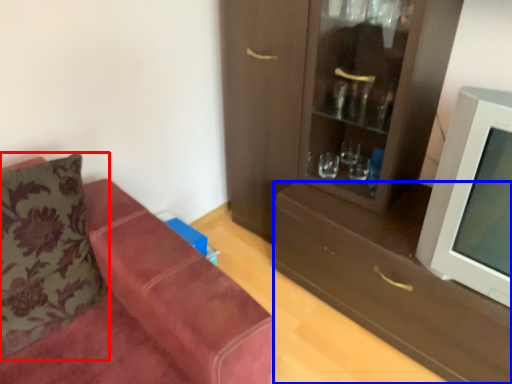
Question: Which point is closer to the camera, pillow (highlighted by a red box) or drawer (highlighted by a blue box)?

Choices:
 (A) pillow
 (B) drawer

Answer: (A)